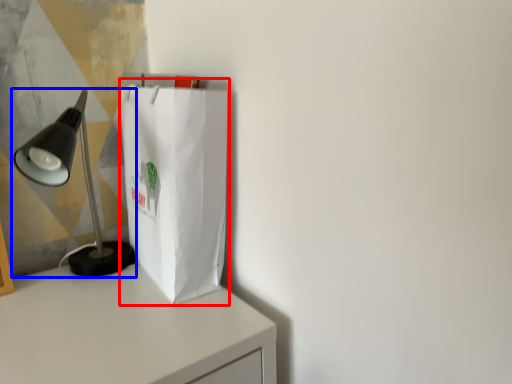
Question: Which object appears closest to the camera in this image, grocery bag (highlighted by a red box) or lamp (highlighted by a blue box)?

Choices:
 (A) grocery bag
 (B) lamp

Answer: (B)